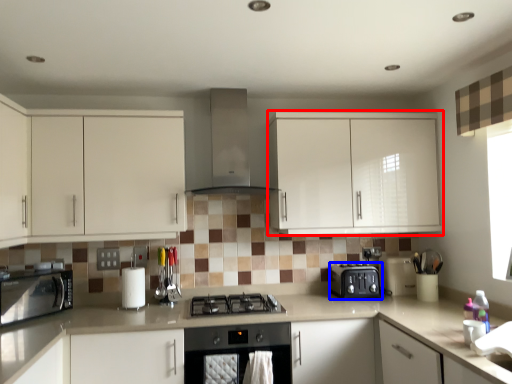
Question: Which object appears closest to the camera in this image, cabinetry (highlighted by a red box) or kitchen appliance (highlighted by a blue box)?

Choices:
 (A) cabinetry
 (B) kitchen appliance

Answer: (A)